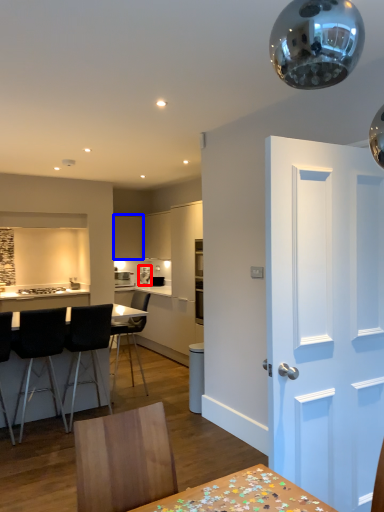
Question: Which object is further to the camera taking this photo, appliance (highlighted by a red box) or cabinetry (highlighted by a blue box)?

Choices:
 (A) appliance
 (B) cabinetry

Answer: (A)